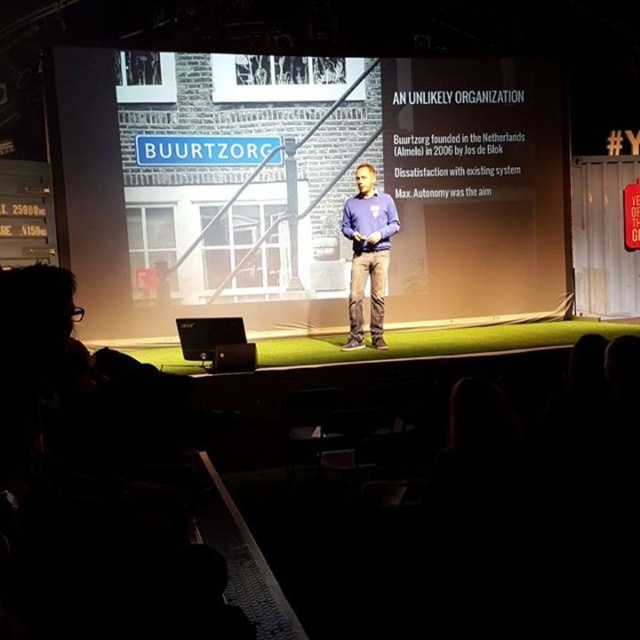
Question: Which of the following is the farthest from the observer?

Choices:
 (A) (250, 348)
 (B) (369, 186)
 (C) (209, 202)

Answer: (C)

Question: Which object appears farthest from the camera in this image?

Choices:
 (A) purple sweater at center
 (B) matte black laptop at center

Answer: (A)

Question: Is white matte projection screen at center above purple sweater at center?

Choices:
 (A) yes
 (B) no

Answer: (A)

Question: Can you confirm if white matte projection screen at center is positioned to the right of purple sweater at center?

Choices:
 (A) yes
 (B) no

Answer: (B)

Question: Is purple sweater at center bigger than matte black laptop at center?

Choices:
 (A) yes
 (B) no

Answer: (A)

Question: Which point appears closest to the camera in this image?

Choices:
 (A) (371, 288)
 (B) (244, 364)
 (C) (240, 205)

Answer: (B)